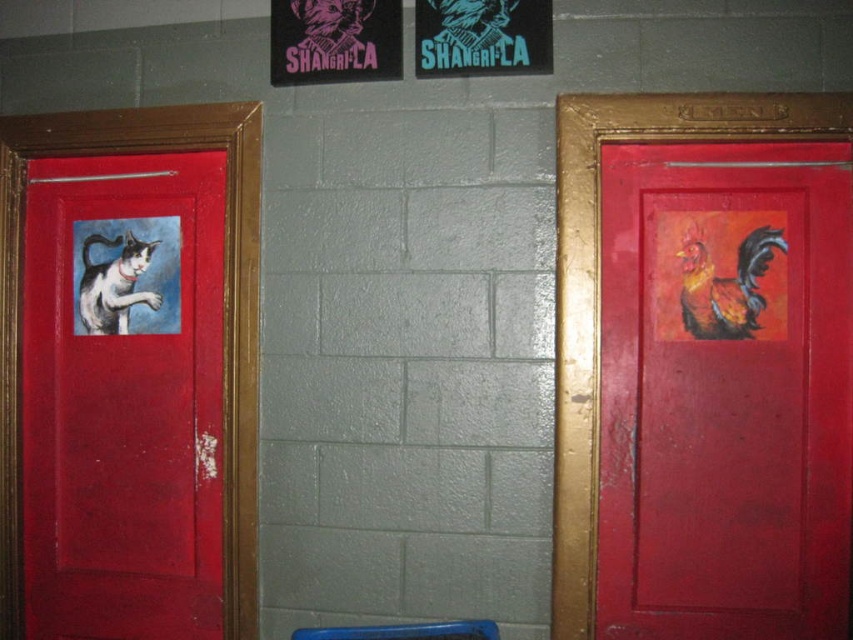
You are standing in a room with a matte pink poster at upper center and a blue plastic stool at lower center. Which object is located to the left of the other?

The matte pink poster at upper center is positioned on the left side of blue plastic stool at lower center.

You are standing in front of two doors and want to enter the room through the matte red door at left. If your reach is 1.7 meters, can you comfortably open the door without needing to move closer?

The matte red door at left is 1.65 meters away from the viewer. Since your reach is 1.7 meters, you can comfortably open the door without needing to move closer.

You are an interior designer planning to add a new shelf between the matte pink poster at upper center and the blue plastic stool at lower center. Based on their sizes, which object should the shelf be placed closer to?

The shelf should be placed closer to the blue plastic stool at lower center because the matte pink poster at upper center occupies less space, meaning the stool takes up more area and requires more space between them.